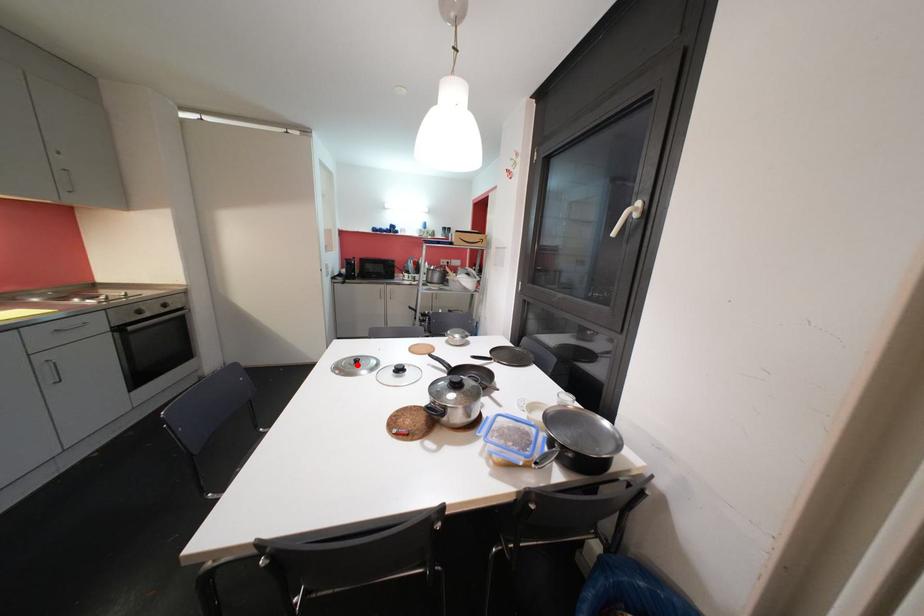
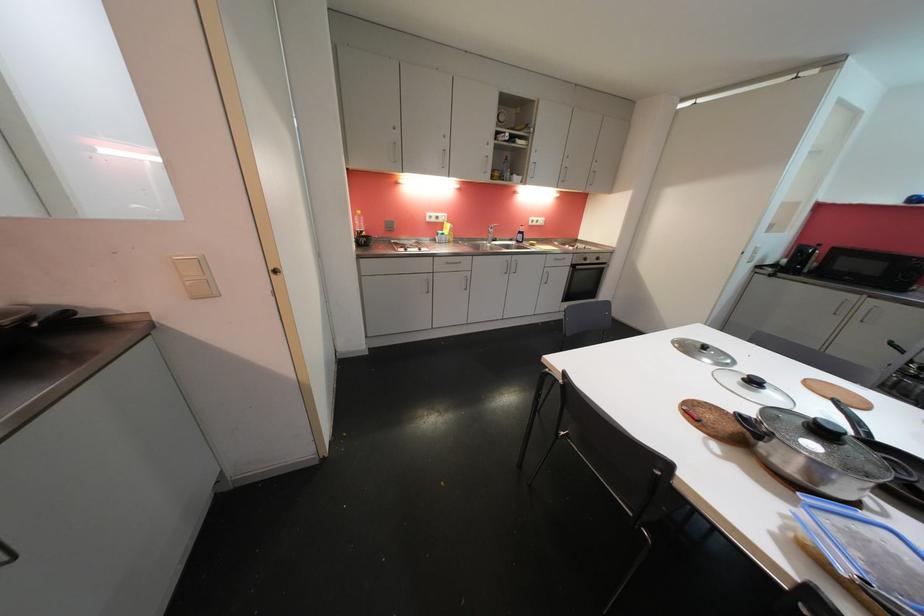
In the second image, find the point that corresponds to the highlighted location in the first image.

(703, 349)